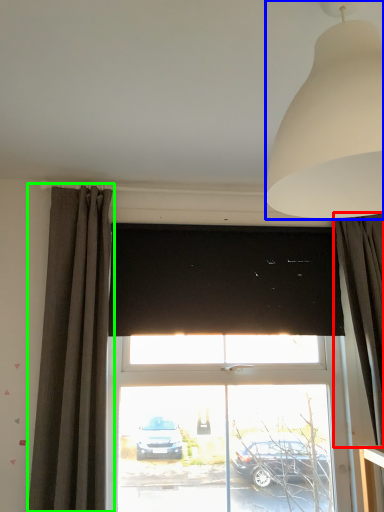
Question: Estimate the real-world distances between objects in this image. Which object is closer to curtain (highlighted by a red box), lamp (highlighted by a blue box) or curtain (highlighted by a green box)?

Choices:
 (A) lamp
 (B) curtain

Answer: (A)